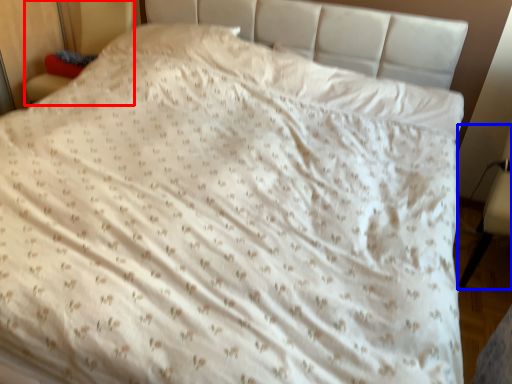
Question: Which object appears farthest to the camera in this image, armchair (highlighted by a red box) or armchair (highlighted by a blue box)?

Choices:
 (A) armchair
 (B) armchair

Answer: (A)